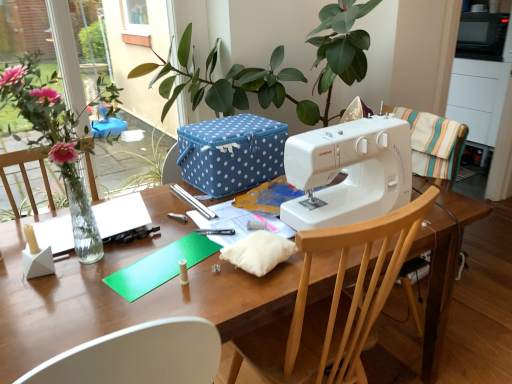
Locate an element on the screen. wooden table at center is located at coordinates (124, 299).

You are a GUI agent. You are given a task and a screenshot of the screen. Output one action in this format:
    pyautogui.click(x=<x>, y=<y>)
    Task: Click on the green leafy plant at left
    This screenshot has width=512, height=384.
    Given the screenshot: What is the action you would take?
    pyautogui.click(x=59, y=139)

Describe the element at coordinates (59, 139) in the screenshot. Image resolution: width=512 pixels, height=384 pixels. I see `green leafy plant at left` at that location.

Measure the distance between point [456,133] and camera.

Point [456,133] and camera are 4.90 feet apart from each other.

Identify the location of wooden chair at right, marked as the second chair in a bottom-to-top arrangement. (433, 143).

Measure the distance between point (345,202) and camera.

Point (345,202) is 3.73 feet away from camera.

What do you see at coordinates (333, 305) in the screenshot?
I see `wooden chair at center, placed as the 1th chair when sorted from left to right` at bounding box center [333, 305].

The image size is (512, 384). Find the location of `wooden table at center`. wooden table at center is located at coordinates (124, 299).

Between white plastic sewing machine at center and wooden table at center, which one is positioned behind?

white plastic sewing machine at center is more distant.

Considering the positions of points (341, 156) and (61, 347), is point (341, 156) closer to camera compared to point (61, 347)?

That is False.

Could you tell me if white plastic sewing machine at center is facing wooden table at center?

No, white plastic sewing machine at center is not aimed at wooden table at center.

Is white plastic sewing machine at center bigger or smaller than wooden chair at center, the first chair from the bottom?

In the image, white plastic sewing machine at center appears to be smaller than wooden chair at center, the first chair from the bottom.

Which is behind, point (322, 200) or point (313, 250)?

The point (322, 200) is farther.

Is white plastic sewing machine at center further to the viewer compared to wooden chair at center, placed as the 1th chair when sorted from left to right?

Yes, white plastic sewing machine at center is further from the viewer.

From the picture: Between blue polka dot fabric box at center and white plastic sewing machine at center, which one appears on the right side from the viewer's perspective?

white plastic sewing machine at center is more to the right.

From a real-world perspective, who is located higher, blue polka dot fabric box at center or white plastic sewing machine at center?

white plastic sewing machine at center.

From the image's perspective, is blue polka dot fabric box at center located above white plastic sewing machine at center?

Indeed, from the image's perspective, blue polka dot fabric box at center is shown above white plastic sewing machine at center.

Which of these two, blue polka dot fabric box at center or white plastic sewing machine at center, stands shorter?

blue polka dot fabric box at center is shorter.

Are wooden chair at right, the 1th chair viewed from the right, and green leafy plant at left beside each other?

No.

Considering the sizes of objects wooden chair at right, the 1th chair viewed from the right, and green leafy plant at left in the image provided, who is shorter, wooden chair at right, the 1th chair viewed from the right, or green leafy plant at left?

With less height is wooden chair at right, the 1th chair viewed from the right.

Measure the distance between wooden chair at right, the 1th chair viewed from the right, and green leafy plant at left.

wooden chair at right, the 1th chair viewed from the right, is 3.31 feet from green leafy plant at left.

What are the coordinates of `houseplant lying on the left of wooden chair at right, which appears as the first chair when viewed from the top` in the screenshot? It's located at (59, 139).

Is wooden table at center taller than wooden chair at right, which appears as the first chair when viewed from the top?

Correct, wooden table at center is much taller as wooden chair at right, which appears as the first chair when viewed from the top.

Where is `table in front of the wooden chair at right, positioned as the second chair in left-to-right order`? table in front of the wooden chair at right, positioned as the second chair in left-to-right order is located at coordinates (124, 299).

Measure the distance from wooden table at center to wooden chair at right, positioned as the second chair in left-to-right order.

wooden table at center and wooden chair at right, positioned as the second chair in left-to-right order, are 24.85 inches apart from each other.

Does wooden table at center contain wooden chair at right, which appears as the first chair when viewed from the top?

No, wooden table at center does not contain wooden chair at right, which appears as the first chair when viewed from the top.

How distant is blue polka dot fabric box at center from wooden chair at right, the 1th chair viewed from the right?

A distance of 21.22 inches exists between blue polka dot fabric box at center and wooden chair at right, the 1th chair viewed from the right.

From the image's perspective, between blue polka dot fabric box at center and wooden chair at right, which appears as the first chair when viewed from the top, who is located below?

blue polka dot fabric box at center appears lower in the image.

Does blue polka dot fabric box at center have a greater width compared to wooden chair at right, positioned as the second chair in left-to-right order?

Correct, the width of blue polka dot fabric box at center exceeds that of wooden chair at right, positioned as the second chair in left-to-right order.

Consider the image. From a real-world perspective, is blue polka dot fabric box at center positioned above or below wooden chair at right, marked as the second chair in a bottom-to-top arrangement?

blue polka dot fabric box at center is above wooden chair at right, marked as the second chair in a bottom-to-top arrangement.

Is wooden table at center facing towards blue polka dot fabric box at center?

No.

Does wooden table at center have a larger size compared to blue polka dot fabric box at center?

Yes, wooden table at center is bigger than blue polka dot fabric box at center.

From a real-world perspective, who is located higher, wooden table at center or blue polka dot fabric box at center?

blue polka dot fabric box at center.

Can we say wooden table at center lies outside blue polka dot fabric box at center?

Yes.

The width and height of the screenshot is (512, 384). What are the coordinates of `table on the left of white plastic sewing machine at center` in the screenshot? It's located at (124, 299).

Where is `the 2nd chair directly beneath the white plastic sewing machine at center (from a real-world perspective)`? Image resolution: width=512 pixels, height=384 pixels. the 2nd chair directly beneath the white plastic sewing machine at center (from a real-world perspective) is located at coordinates (333, 305).

Based on their spatial positions, is white plastic sewing machine at center or wooden chair at center, the first chair from the bottom, closer to green leafy plant at left?

wooden chair at center, the first chair from the bottom, lies closer to green leafy plant at left than the other object.

Looking at the image, which one is located closer to wooden table at center, green leafy plant at left or white plastic sewing machine at center?

white plastic sewing machine at center is positioned closer to the anchor wooden table at center.

When comparing their distances from wooden chair at center, placed as the 1th chair when sorted from left to right, does white plastic sewing machine at center or wooden table at center seem closer?

Among the two, wooden table at center is located nearer to wooden chair at center, placed as the 1th chair when sorted from left to right.

From the picture: From the image, which object appears to be farther from green leafy plant at left, blue polka dot fabric box at center or white plastic sewing machine at center?

white plastic sewing machine at center.

Estimate the real-world distances between objects in this image. Which object is closer to blue polka dot fabric box at center, white plastic sewing machine at center or wooden chair at center, which appears as the second chair when viewed from the right?

white plastic sewing machine at center is positioned closer to the anchor blue polka dot fabric box at center.

Estimate the real-world distances between objects in this image. Which object is further from white plastic sewing machine at center, wooden chair at center, which appears as the second chair when viewed from the right, or wooden chair at right, marked as the second chair in a bottom-to-top arrangement?

Based on the image, wooden chair at right, marked as the second chair in a bottom-to-top arrangement, appears to be further to white plastic sewing machine at center.

Estimate the real-world distances between objects in this image. Which object is closer to wooden chair at right, marked as the second chair in a bottom-to-top arrangement, wooden table at center or green leafy plant at left?

wooden table at center lies closer to wooden chair at right, marked as the second chair in a bottom-to-top arrangement, than the other object.

From the picture: Which object lies nearer to the anchor point white plastic sewing machine at center, wooden table at center or wooden chair at right, marked as the second chair in a bottom-to-top arrangement?

wooden table at center is positioned closer to the anchor white plastic sewing machine at center.

I want to click on table situated between green leafy plant at left and white plastic sewing machine at center from left to right, so click(x=124, y=299).

Where is `table between green leafy plant at left and wooden chair at center, the first chair from the bottom`? The image size is (512, 384). table between green leafy plant at left and wooden chair at center, the first chair from the bottom is located at coordinates (124, 299).

The width and height of the screenshot is (512, 384). What are the coordinates of `chair between green leafy plant at left and blue polka dot fabric box at center along the z-axis` in the screenshot? It's located at (333, 305).

Identify the location of sewing machine positioned between wooden table at center and blue polka dot fabric box at center from near to far. This screenshot has height=384, width=512. (348, 172).